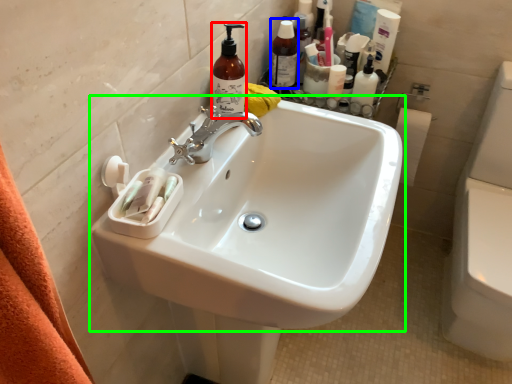
Question: Considering the real-world distances, which object is closest to cleaning product (highlighted by a red box)? toiletry (highlighted by a blue box) or sink (highlighted by a green box).

Choices:
 (A) toiletry
 (B) sink

Answer: (B)